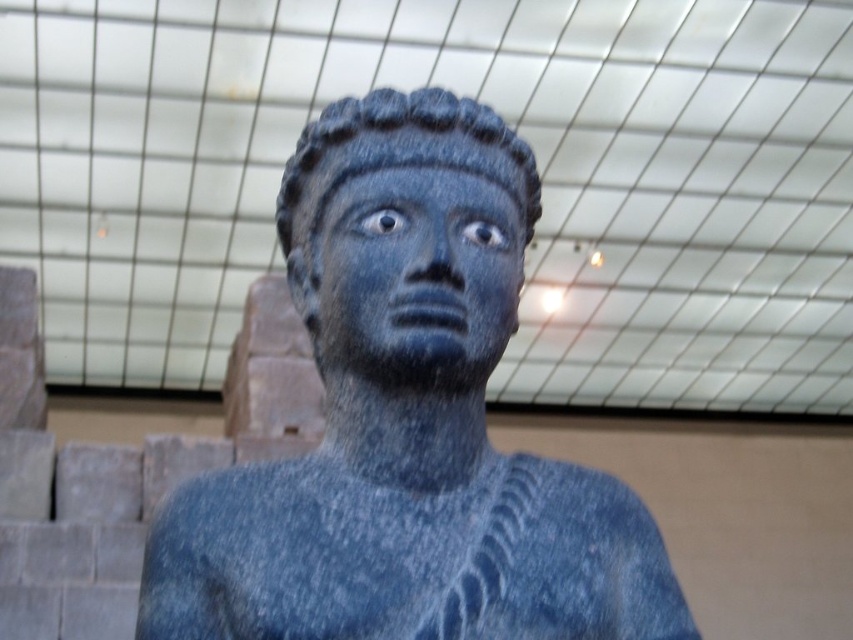
Between point (463, 173) and point (486, 362), which one is positioned in front?

Point (486, 362) is more forward.

Is slate stone statue at center thinner than matte stone face at center?

No, slate stone statue at center is not thinner than matte stone face at center.

Which is in front, point (521, 141) or point (381, 298)?

Positioned in front is point (381, 298).

Locate an element on the screen. The width and height of the screenshot is (853, 640). slate stone statue at center is located at coordinates (407, 420).